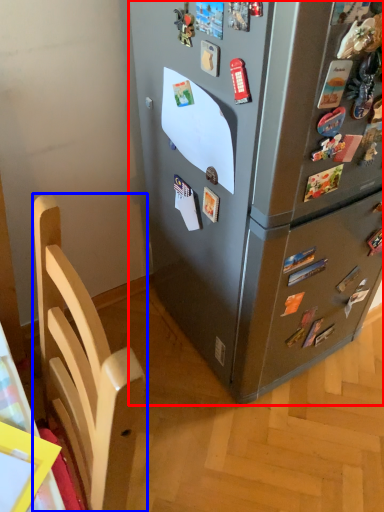
Question: Which of the following is the closest to the observer, refrigerator (highlighted by a red box) or furniture (highlighted by a blue box)?

Choices:
 (A) refrigerator
 (B) furniture

Answer: (B)